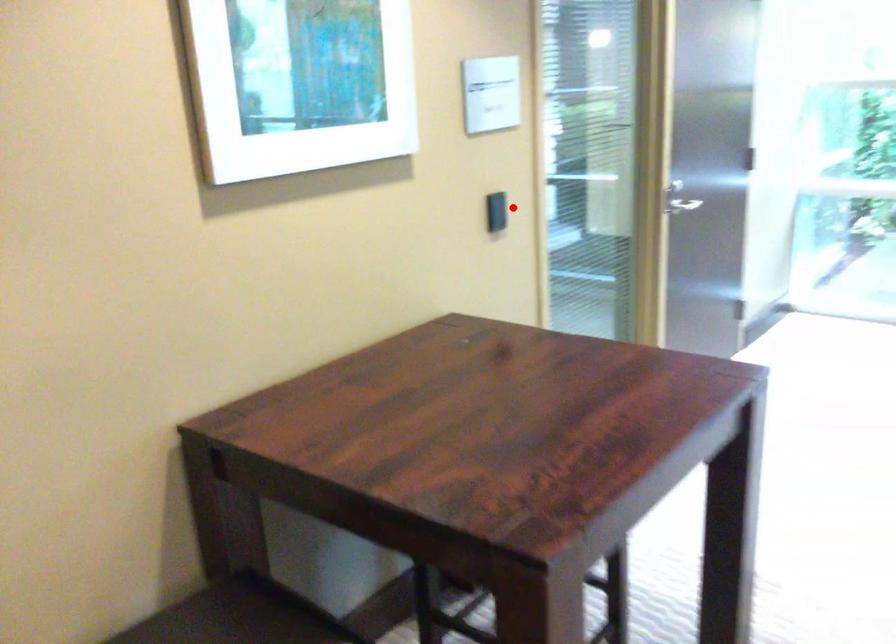
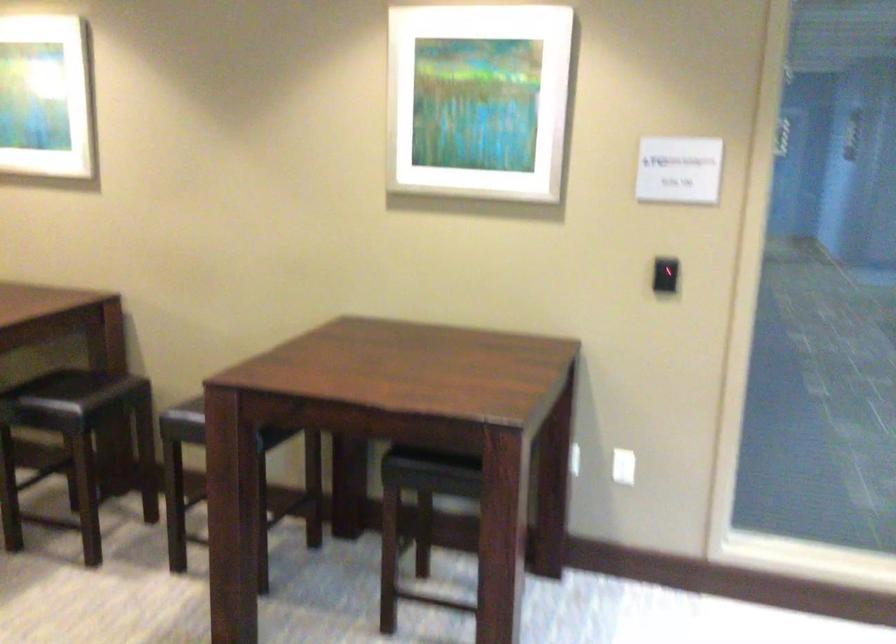
The point at the highlighted location is marked in the first image. Where is the corresponding point in the second image?

(665, 275)